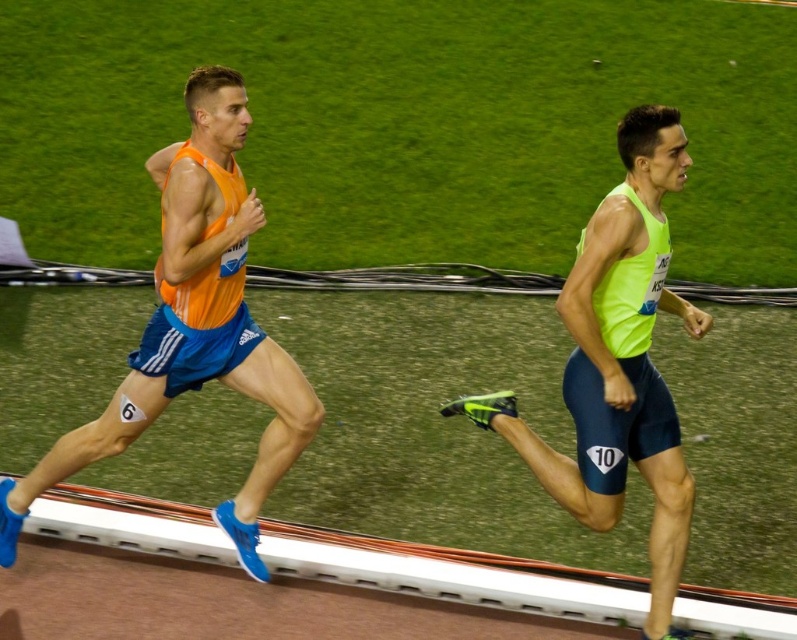
Does matte orange tank top at left have a smaller size compared to neon green fabric shorts at right?

Yes, matte orange tank top at left is smaller than neon green fabric shorts at right.

The image size is (797, 640). Find the location of `matte orange tank top at left`. matte orange tank top at left is located at coordinates (194, 324).

This screenshot has width=797, height=640. Find the location of `matte orange tank top at left`. matte orange tank top at left is located at coordinates (194, 324).